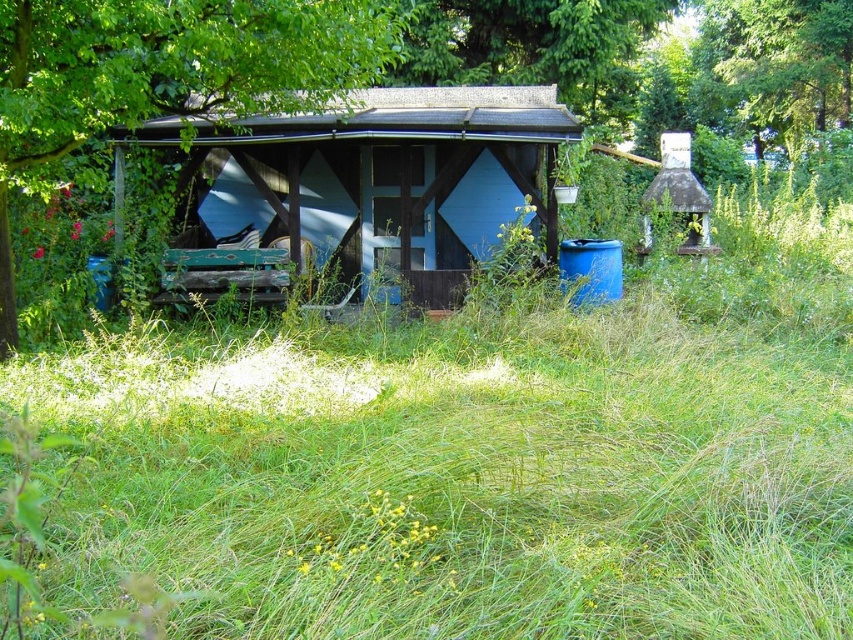
Does wooden hut at center come in front of green leafy tree at upper left?

That is False.

Is point (523, 198) in front of point (160, 13)?

No, it is behind (160, 13).

Identify the location of wooden hut at center. (370, 189).